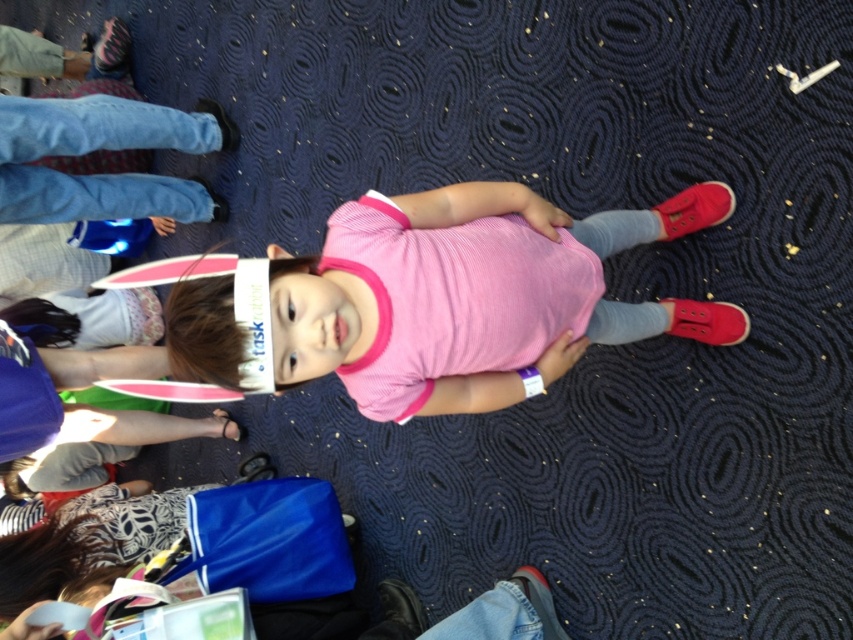
Question: Which object appears farthest from the camera in this image?

Choices:
 (A) pink ribbed fabric dress at center
 (B) pink ribbed shirt at center

Answer: (A)

Question: Does pink ribbed shirt at center appear on the right side of pink ribbed fabric dress at center?

Choices:
 (A) no
 (B) yes

Answer: (B)

Question: Does pink ribbed shirt at center appear on the right side of pink ribbed fabric dress at center?

Choices:
 (A) no
 (B) yes

Answer: (B)

Question: Is pink ribbed shirt at center above pink ribbed fabric dress at center?

Choices:
 (A) yes
 (B) no

Answer: (A)

Question: Among these objects, which one is farthest from the camera?

Choices:
 (A) pink ribbed shirt at center
 (B) pink ribbed fabric dress at center

Answer: (B)